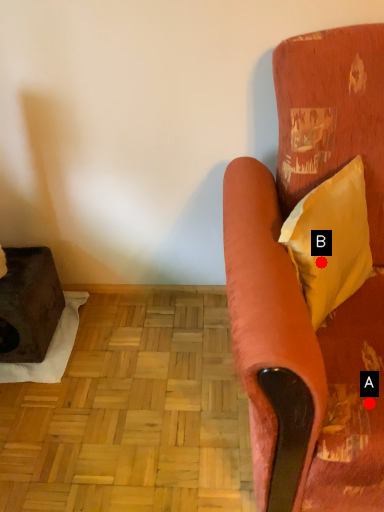
Question: Two points are circled on the image, labeled by A and B beside each circle. Which of the following is the closest to the observer?

Choices:
 (A) A is closer
 (B) B is closer

Answer: (A)